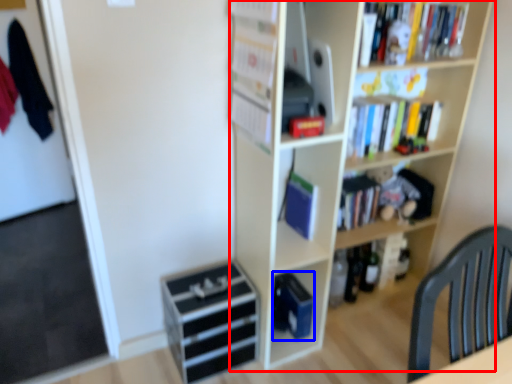
Question: Which object is further to the camera taking this photo, bookcase (highlighted by a red box) or paperback book (highlighted by a blue box)?

Choices:
 (A) bookcase
 (B) paperback book

Answer: (B)